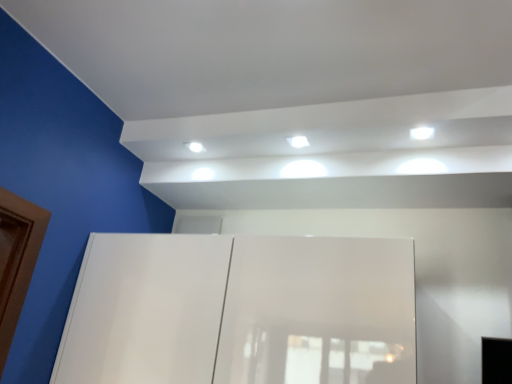
Question: Considering the relative sizes of white glossy light at center, arranged as the 1th light when viewed from the back, and white glossy light at upper right, the 2th light in the left-to-right sequence, in the image provided, is white glossy light at center, arranged as the 1th light when viewed from the back, wider than white glossy light at upper right, the 2th light in the left-to-right sequence,?

Choices:
 (A) no
 (B) yes

Answer: (A)

Question: From a real-world perspective, is white glossy light at center, the 1th light in the left-to-right sequence, physically below white glossy light at upper right, acting as the second light starting from the back?

Choices:
 (A) yes
 (B) no

Answer: (B)

Question: Are white glossy light at center, arranged as the 1th light when viewed from the back, and white glossy light at upper right, the 2th light in the left-to-right sequence, far apart?

Choices:
 (A) yes
 (B) no

Answer: (B)

Question: Could white glossy light at upper right, the 1th light from the right, be considered to be inside white glossy light at center, which is counted as the second light, starting from the right?

Choices:
 (A) yes
 (B) no

Answer: (B)

Question: Considering the relative sizes of white glossy light at center, arranged as the 1th light when viewed from the back, and white glossy light at upper right, the 2th light in the left-to-right sequence, in the image provided, is white glossy light at center, arranged as the 1th light when viewed from the back, taller than white glossy light at upper right, the 2th light in the left-to-right sequence,?

Choices:
 (A) no
 (B) yes

Answer: (B)

Question: Considering the positions of white glossy light at upper right, acting as the second light starting from the back, and white glossy light fixture at upper center in the image, is white glossy light at upper right, acting as the second light starting from the back, wider or thinner than white glossy light fixture at upper center?

Choices:
 (A) thin
 (B) wide

Answer: (B)

Question: From the image's perspective, is white glossy light at upper right, the 2th light in the left-to-right sequence, above or below white glossy light fixture at upper center?

Choices:
 (A) above
 (B) below

Answer: (A)

Question: Considering the positions of point (417, 137) and point (200, 144), is point (417, 137) closer or farther from the camera than point (200, 144)?

Choices:
 (A) closer
 (B) farther

Answer: (A)

Question: From a real-world perspective, relative to white glossy light fixture at upper center, is white glossy light at upper right, the 1th light from the right, vertically above or below?

Choices:
 (A) above
 (B) below

Answer: (A)

Question: Visually, is white glossy light at center, the 1th light in the left-to-right sequence, positioned to the left or to the right of white glossy light fixture at upper center?

Choices:
 (A) left
 (B) right

Answer: (B)

Question: From a real-world perspective, is white glossy light at center, which is counted as the second light, starting from the right, positioned above or below white glossy light fixture at upper center?

Choices:
 (A) below
 (B) above

Answer: (B)

Question: Is white glossy light at center, placed as the second light when sorted from front to back, inside the boundaries of white glossy light fixture at upper center, or outside?

Choices:
 (A) outside
 (B) inside

Answer: (A)

Question: Looking at their shapes, would you say white glossy light at center, arranged as the 1th light when viewed from the back, is wider or thinner than white glossy light fixture at upper center?

Choices:
 (A) thin
 (B) wide

Answer: (B)

Question: Based on their positions, is white glossy light fixture at upper center located to the left or right of white glossy light at center, the 1th light in the left-to-right sequence?

Choices:
 (A) right
 (B) left

Answer: (B)

Question: Is white glossy light fixture at upper center in front of or behind white glossy light at center, which is counted as the second light, starting from the right, in the image?

Choices:
 (A) behind
 (B) front

Answer: (A)